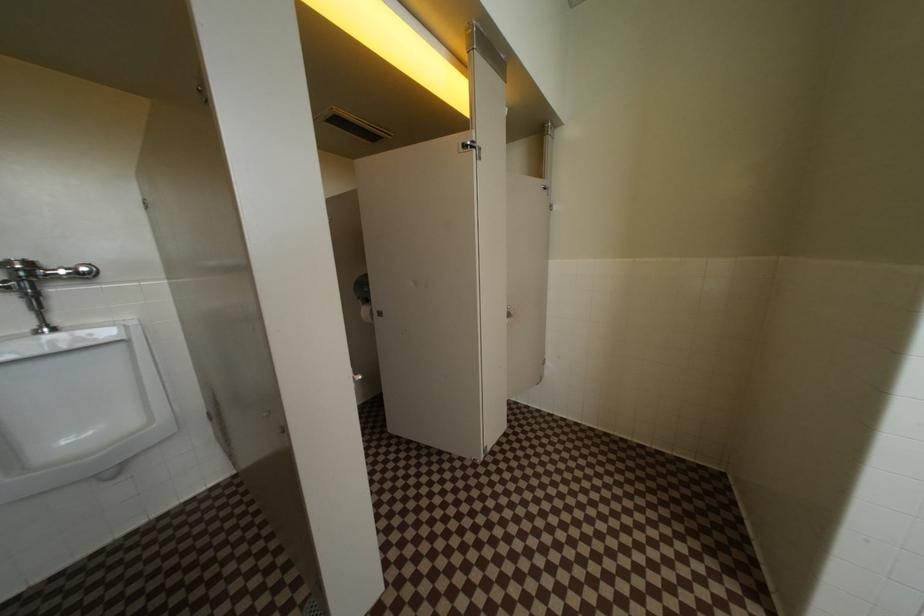
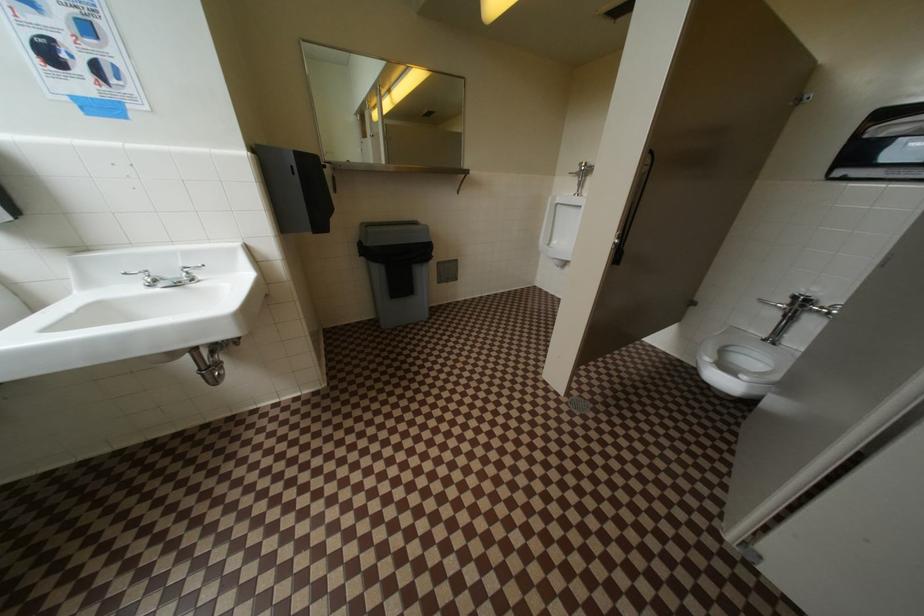
How did the camera likely rotate?

The camera rotated toward left-down.